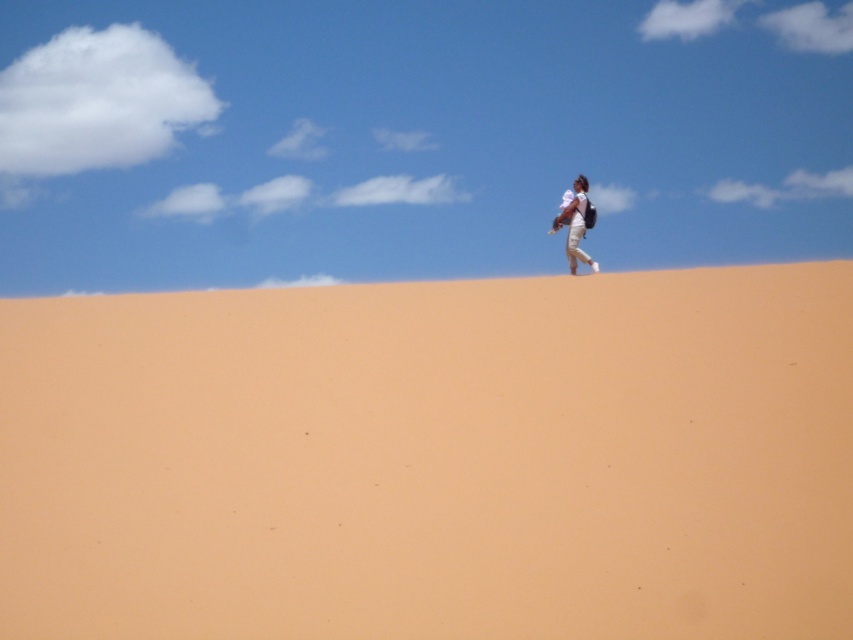
Can you confirm if smooth tan sand at upper center is bigger than white cotton shirt at upper center?

Yes, smooth tan sand at upper center is bigger than white cotton shirt at upper center.

Does smooth tan sand at upper center lie in front of white cotton shirt at upper center?

Yes, smooth tan sand at upper center is closer to the viewer.

The height and width of the screenshot is (640, 853). Describe the element at coordinates (433, 458) in the screenshot. I see `smooth tan sand at upper center` at that location.

Find the location of a particular element. Image resolution: width=853 pixels, height=640 pixels. smooth tan sand at upper center is located at coordinates (433, 458).